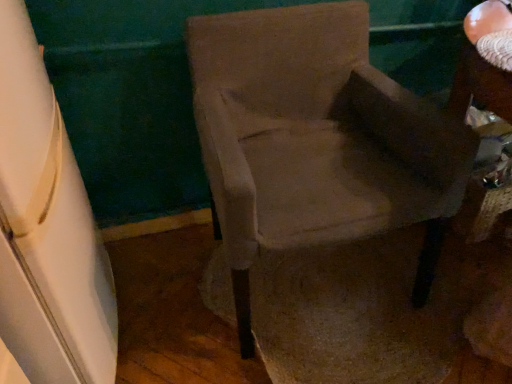
The width and height of the screenshot is (512, 384). I want to click on free space to the left of suede-like beige chair at center, so click(176, 286).